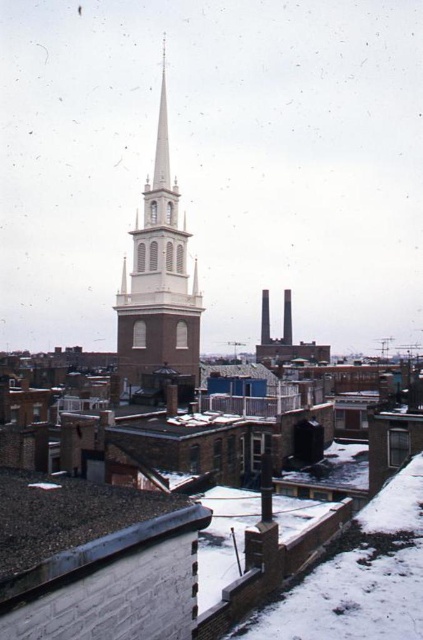
You are standing in the city looking at the gray shingles at lower left and the white brick steeple at center. Which object is nearer to you?

The gray shingles at lower left are closer to the viewer than the white brick steeple at center.

You are an architect analyzing the cityscape. You see a point labeled at coordinates (77, 529). Based on the scene description, what material is present at that location?

The point at coordinates (77, 529) corresponds to gray shingles at lower left.

You are standing in the city looking at the church steeple. There are two points marked in the image. Which point, point (36,483) or point (167,305), is closer to you?

Point (36,483) is closer to the viewer than point (167,305).